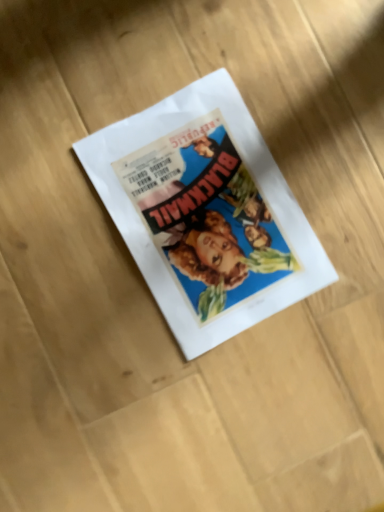
At what (x,y) coordinates should I click in order to perform the action: click on empty space that is ontop of matte paper poster at center (from a real-world perspective). Please return your answer as a coordinate pair (x, y). The width and height of the screenshot is (384, 512). Looking at the image, I should click on (210, 213).